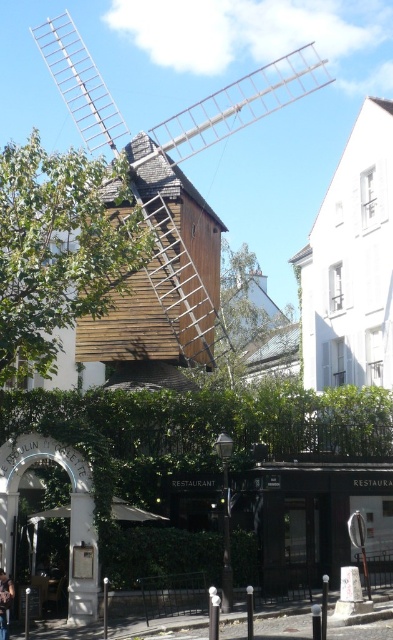
Is wooden windmill at center positioned at the back of dark brown leather jacket at lower left?

Yes, it is behind dark brown leather jacket at lower left.

Which is above, wooden windmill at center or dark brown leather jacket at lower left?

Positioned higher is wooden windmill at center.

Does point (268, 92) come farther from viewer compared to point (7, 580)?

Yes, point (268, 92) is behind point (7, 580).

This screenshot has width=393, height=640. What are the coordinates of `wooden windmill at center` in the screenshot? It's located at (238, 104).